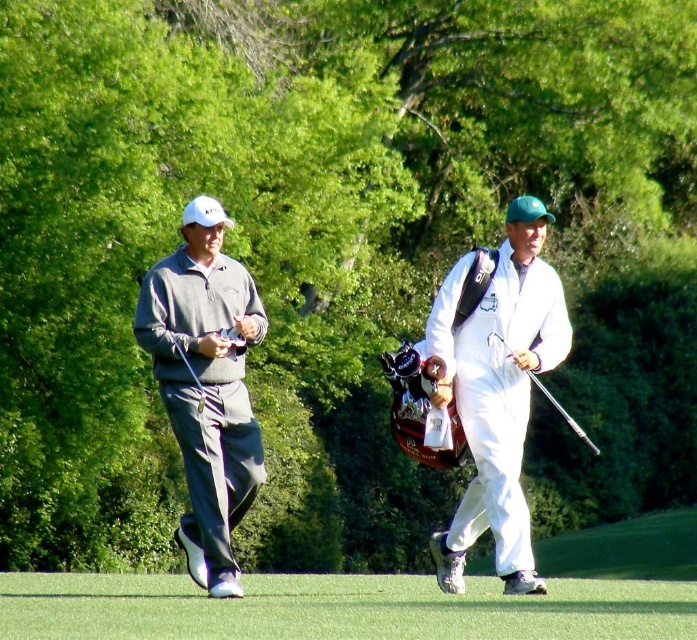
You are a photographer trying to capture a closeup shot of the matte gray sweater at left and the metallic silver golf club at right. Given their sizes, which object should you zoom in more on to ensure both are clearly visible in the frame?

The matte gray sweater at left is smaller than the metallic silver golf club at right. To ensure both are clearly visible, you should zoom in more on the metallic silver golf club at right since it is larger and requires more focus to capture details without making the sweater appear too small in comparison.

You are a golfer who needs to choose between the white matte golf bag at center and the metallic silver golf club at right based on their sizes. Which one is bigger?

The metallic silver golf club at right is bigger than the white matte golf bag at center.

You are a photographer positioned behind the two individuals on the golf course. You want to take a photo of the metallic silver golf club at right without the matte gray sweater at left blocking it. Is this possible given their current positions?

The metallic silver golf club at right is behind the matte gray sweater at left, so it is currently blocked by the sweater. To capture the golf club without obstruction, you would need to adjust your angle or have the individuals reposition themselves so the club is no longer behind the sweater.